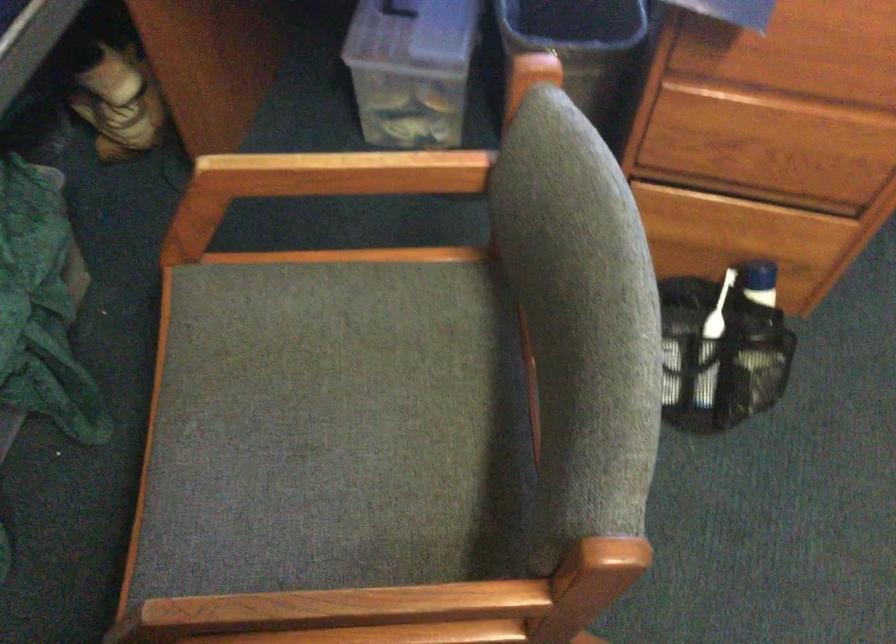
Find where to lift the blue and white bottle. Please return your answer as a coordinate pair (x, y).

(757, 303)